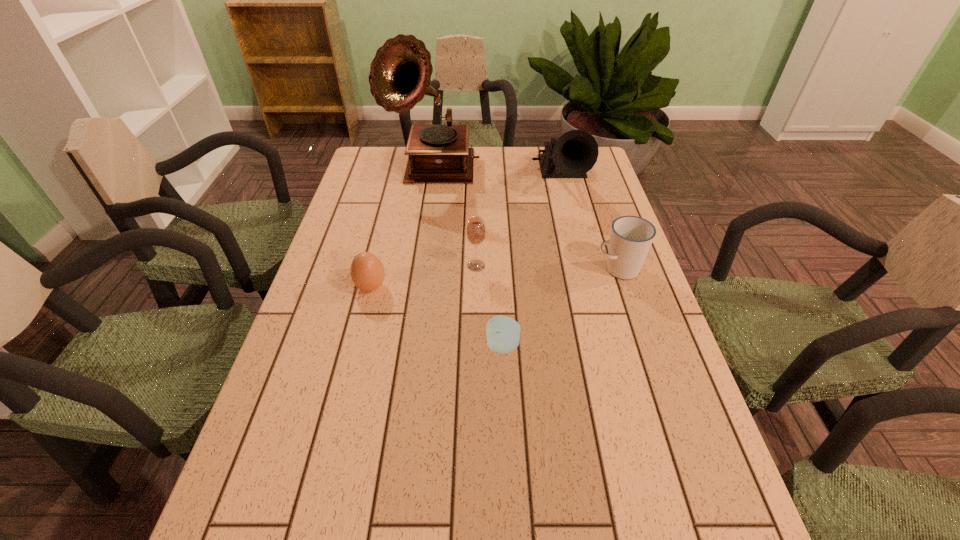
Identify the location of the tallest object. (400, 74).

Where is `the second tallest object`? The image size is (960, 540). the second tallest object is located at coordinates (572, 155).

The width and height of the screenshot is (960, 540). I want to click on wineglass, so click(x=475, y=230).

Image resolution: width=960 pixels, height=540 pixels. In order to click on cup in this screenshot , I will do `click(631, 237)`.

Locate an element on the screen. The height and width of the screenshot is (540, 960). boiled egg is located at coordinates (367, 272).

At what (x,y) coordinates should I click in order to perform the action: click on apple. Please return your answer as a coordinate pair (x, y). Looking at the image, I should click on (503, 333).

Identify the location of the shortest object. This screenshot has height=540, width=960. (503, 333).

I want to click on free location located 0.180m on the horn of the tallest object, so click(x=424, y=225).

You are a GUI agent. You are given a task and a screenshot of the screen. Output one action in this format:
    pyautogui.click(x=<x>, y=<y>)
    Task: Click on the vacant space located 0.080m from the horn of the fifth shortest object
    This screenshot has width=960, height=540.
    Given the screenshot: What is the action you would take?
    pyautogui.click(x=572, y=224)

The width and height of the screenshot is (960, 540). In order to click on free space located on the right of the wineglass in this screenshot , I will do coord(599,266).